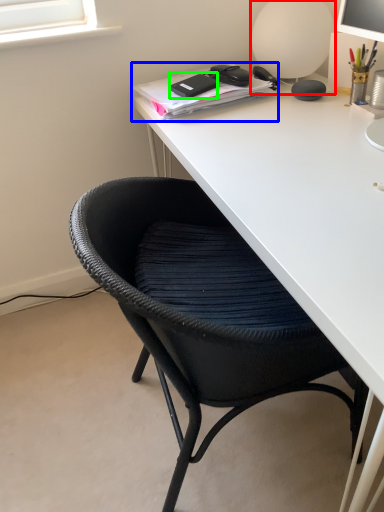
Question: Which is nearer to the table lamp (highlighted by a red box)? notebook (highlighted by a blue box) or stationery (highlighted by a green box).

Choices:
 (A) notebook
 (B) stationery

Answer: (A)